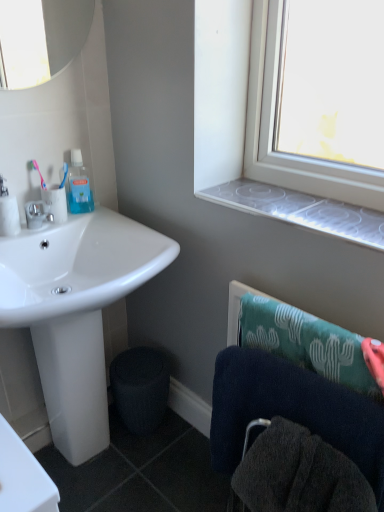
This screenshot has height=512, width=384. I want to click on free location to the right of white glossy toilet paper at left, the first toilet paper when ordered from right to left, so click(92, 217).